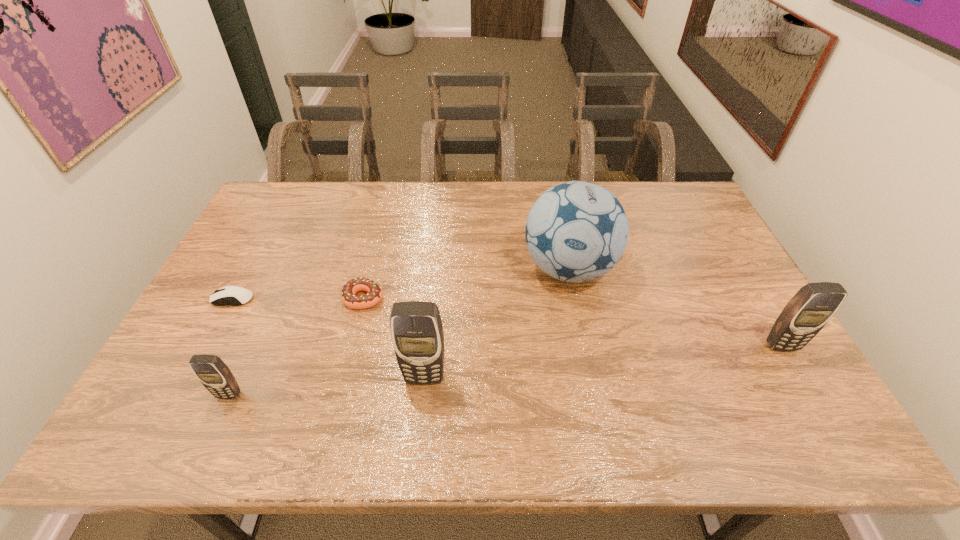
Please point a space for a new cellular_telephone to maintain equal intervals. Please provide its 2D coordinates. Your answer should be formatted as a tuple, i.e. [(x, y)], where the tuple contains the x and y coordinates of a point satisfying the conditions above.

[(609, 361)]